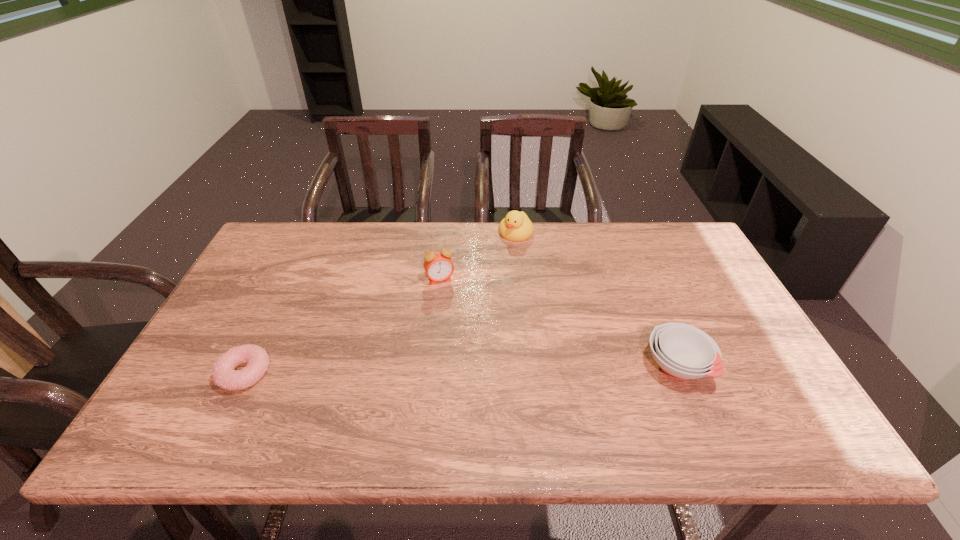
This screenshot has width=960, height=540. Identify the location of doughnut. (224, 375).

You are a GUI agent. You are given a task and a screenshot of the screen. Output one action in this format:
    pyautogui.click(x=<x>, y=<y>)
    Task: Click on the leftmost object
    The image size is (960, 540).
    Given the screenshot: What is the action you would take?
    pyautogui.click(x=224, y=375)

Image resolution: width=960 pixels, height=540 pixels. Find the location of `the third tallest object`. the third tallest object is located at coordinates (683, 352).

I want to click on the rightmost object, so click(683, 352).

Locate an element on the screen. This screenshot has height=540, width=960. the third nearest object is located at coordinates (438, 266).

At what (x,y) coordinates should I click in order to perform the action: click on alarm clock. Please return your answer as a coordinate pair (x, y). Looking at the image, I should click on (438, 266).

The width and height of the screenshot is (960, 540). I want to click on the second tallest object, so click(516, 226).

Identify the location of duckling. The height and width of the screenshot is (540, 960). (516, 226).

I want to click on free region located on the back of the doughnut, so click(x=265, y=332).

You are a GUI agent. You are given a task and a screenshot of the screen. Output one action in this format:
    pyautogui.click(x=<x>, y=<y>)
    Task: Click on the vacant space situated on the left of the soup bowl
    
    Given the screenshot: What is the action you would take?
    pyautogui.click(x=554, y=366)